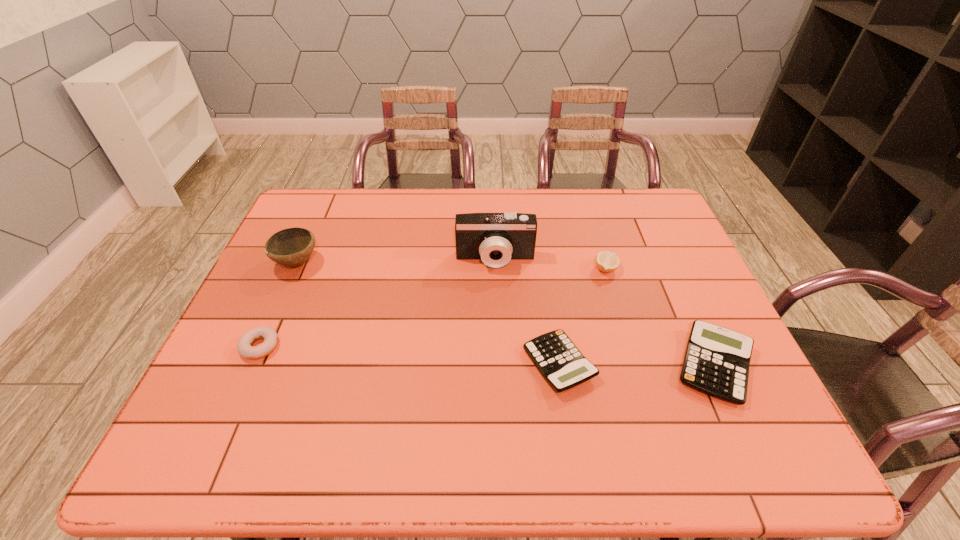
This screenshot has width=960, height=540. I want to click on free area in between the taller calculator and the lemon, so pos(660,317).

At what (x,y) coordinates should I click in order to perform the action: click on vacant area that lies between the camcorder and the left calculator. Please return your answer as a coordinate pair (x, y). Image resolution: width=960 pixels, height=540 pixels. Looking at the image, I should click on (527, 312).

Find the location of a particular element. Image resolution: width=960 pixels, height=540 pixels. unoccupied area between the camcorder and the bowl is located at coordinates (396, 261).

At what (x,y) coordinates should I click in order to perform the action: click on object that can be found as the fourth closest to the doughnut. Please return your answer as a coordinate pair (x, y). This screenshot has width=960, height=540. Looking at the image, I should click on (606, 261).

Identify which object is the closest to the doughnut. Please provide its 2D coordinates. Your answer should be formatted as a tuple, i.e. [(x, y)], where the tuple contains the x and y coordinates of a point satisfying the conditions above.

[(291, 247)]

At what (x,y) coordinates should I click in order to perform the action: click on vacant space that satisfies the following two spatial constraints: 1. on the front side of the second tallest object; 2. on the left side of the right calculator. Please return your answer as a coordinate pair (x, y). This screenshot has height=540, width=960. Looking at the image, I should click on (252, 366).

Locate an element on the screen. Image resolution: width=960 pixels, height=540 pixels. vacant space that satisfies the following two spatial constraints: 1. on the front side of the fifth shortest object; 2. on the left side of the taller calculator is located at coordinates (252, 366).

Where is `free location that satisfies the following two spatial constraints: 1. on the lens of the shorter calculator; 2. on the right side of the camcorder`? This screenshot has height=540, width=960. free location that satisfies the following two spatial constraints: 1. on the lens of the shorter calculator; 2. on the right side of the camcorder is located at coordinates (499, 364).

Identify the location of free spot that satisfies the following two spatial constraints: 1. on the lens of the camcorder; 2. on the left side of the lemon. (495, 269).

Find the location of a particular element. vacant region that satisfies the following two spatial constraints: 1. on the back side of the second object from right to left; 2. on the right side of the doughnut is located at coordinates (295, 269).